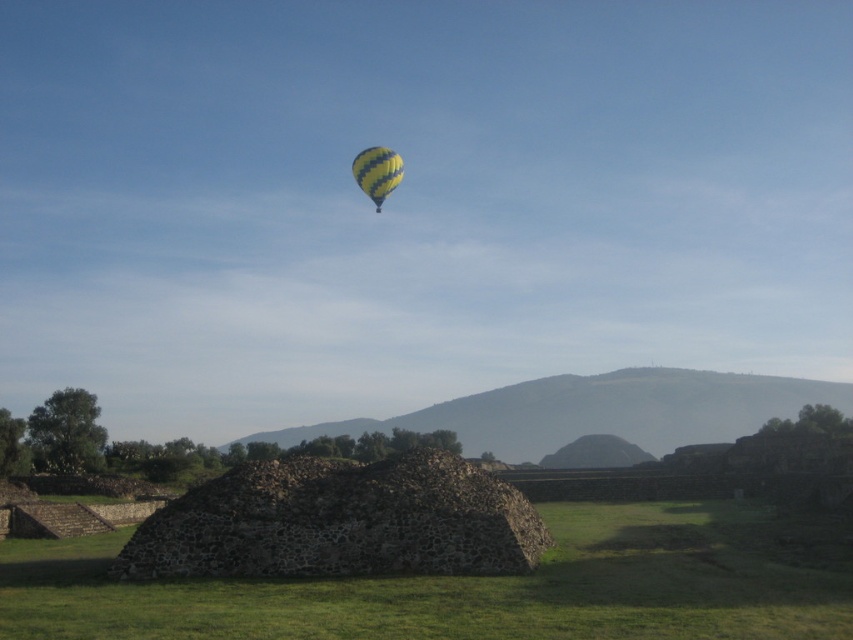
Does dark gray stone pyramid at center appear over yellow striped balloon at upper center?

No, dark gray stone pyramid at center is not above yellow striped balloon at upper center.

The image size is (853, 640). What do you see at coordinates (480, 586) in the screenshot?
I see `dark gray stone pyramid at center` at bounding box center [480, 586].

I want to click on dark gray stone pyramid at center, so click(x=480, y=586).